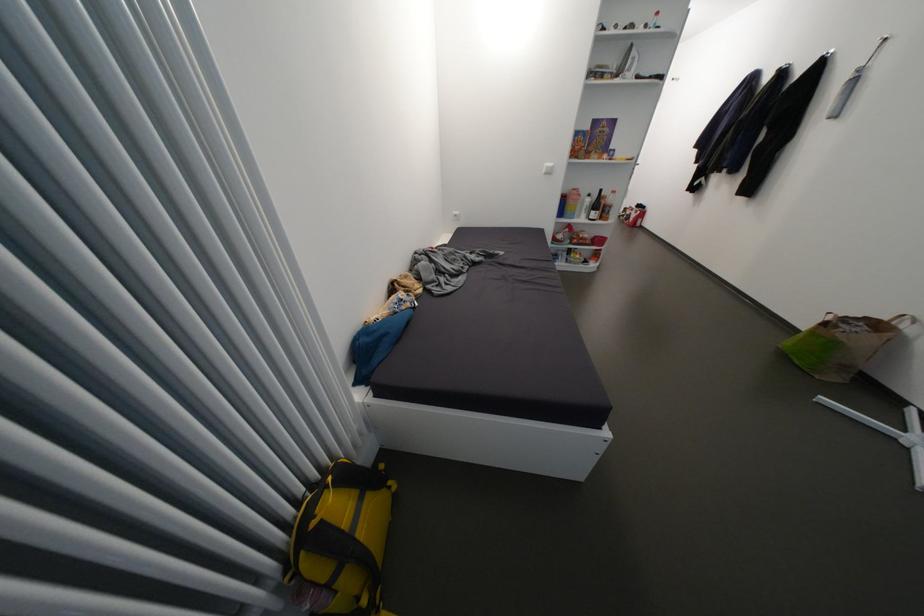
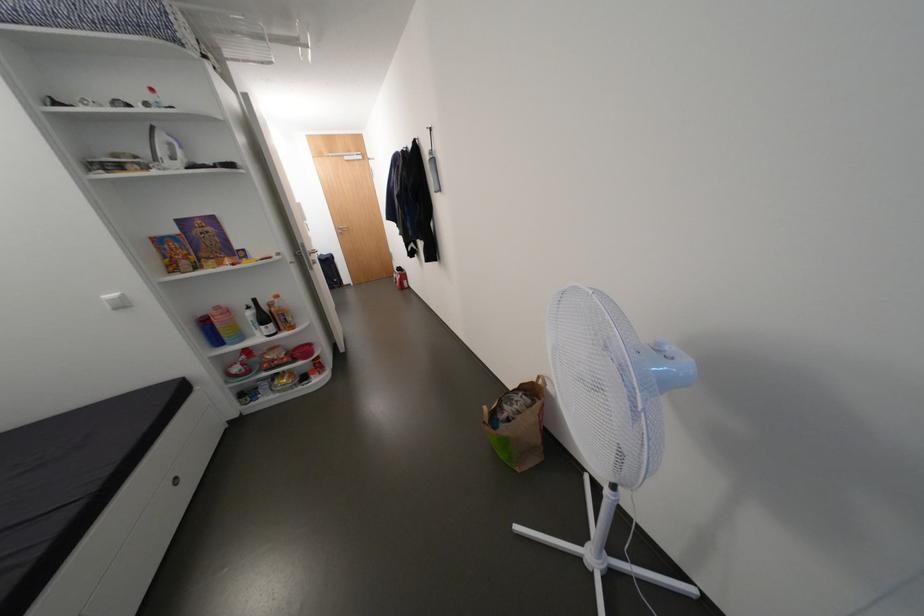
Where in the second image is the point corresponding to (x=605, y=241) from the first image?

(310, 352)